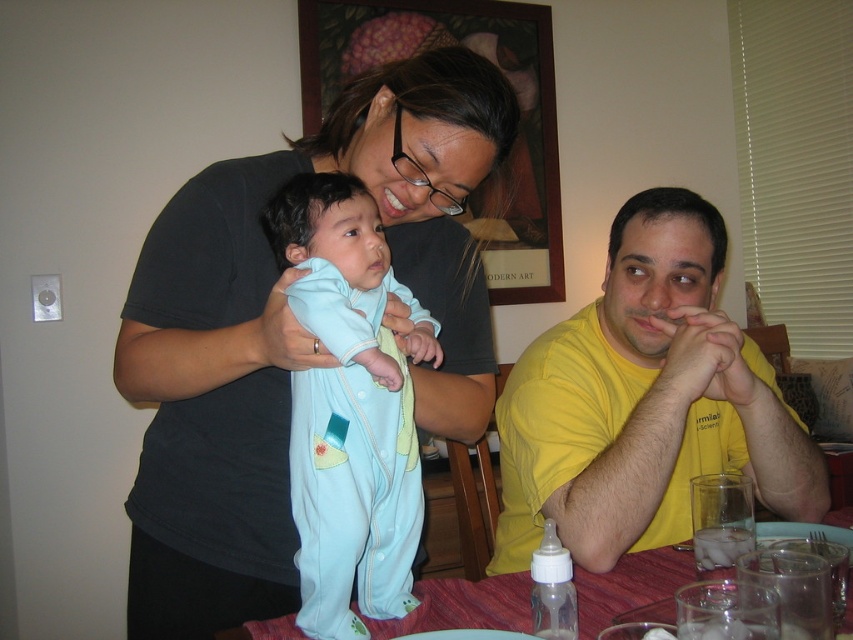
The image size is (853, 640). Identify the location of yellow cotton shirt at right. (645, 401).

Can you confirm if yellow cotton shirt at right is smaller than red tablecloth at lower center?

No.

Who is more distant from viewer, (654, 342) or (527, 598)?

Positioned behind is point (654, 342).

I want to click on yellow cotton shirt at right, so click(x=645, y=401).

Based on the photo, between yellow cotton shirt at right and light blue fabric onesie at center, which one has less height?

Standing shorter between the two is light blue fabric onesie at center.

Does yellow cotton shirt at right appear under light blue fabric onesie at center?

Yes, yellow cotton shirt at right is below light blue fabric onesie at center.

Does point (680, 456) come farther from viewer compared to point (372, 417)?

Yes, point (680, 456) is farther from viewer.

Find the location of `yellow cotton shirt at right`. yellow cotton shirt at right is located at coordinates (645, 401).

Is matte black shirt at upper left below red tablecloth at lower center?

No.

Who is more forward, (177, 474) or (463, 625)?

Point (463, 625) is in front.

Between point (200, 611) and point (399, 630), which one is positioned in front?

Positioned in front is point (399, 630).

The width and height of the screenshot is (853, 640). In order to click on matte black shirt at upper left in this screenshot , I will do `click(291, 333)`.